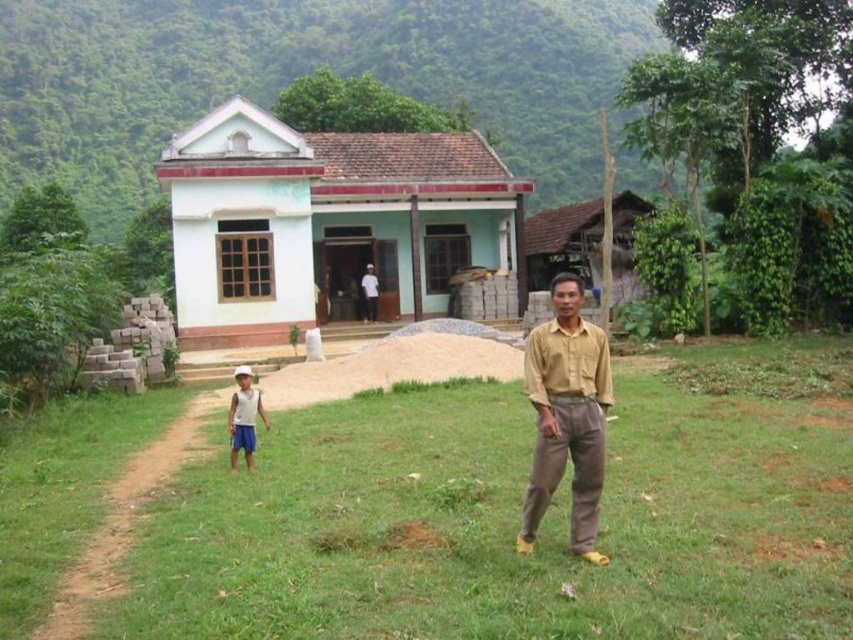
From the picture: You are a photographer planning to capture a landscape shot of the rural scene. You notice the green grass at center and the white cotton shirt at lower left. Which object occupies a larger area in the image?

The green grass at center occupies a larger area in the image since its width surpasses that of the white cotton shirt at lower left.

You are planning to place a new garden bench in the scene. The bench requires a space wider than the light blue painted wood house at center. Can the green grass at center accommodate this requirement?

The green grass at center has a larger width than the light blue painted wood house at center, so it can accommodate the garden bench that requires a space wider than the house.